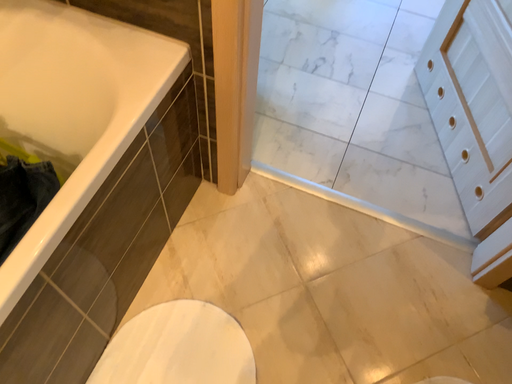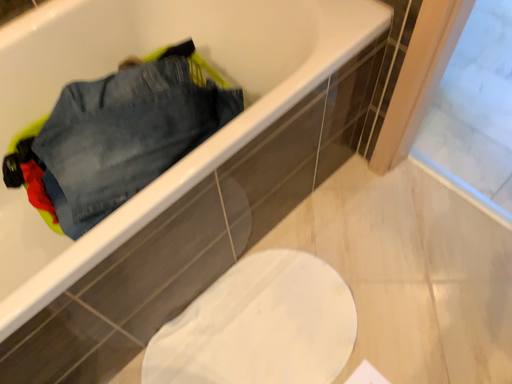
Question: Which way did the camera rotate in the video?

Choices:
 (A) rotated right
 (B) rotated left

Answer: (B)